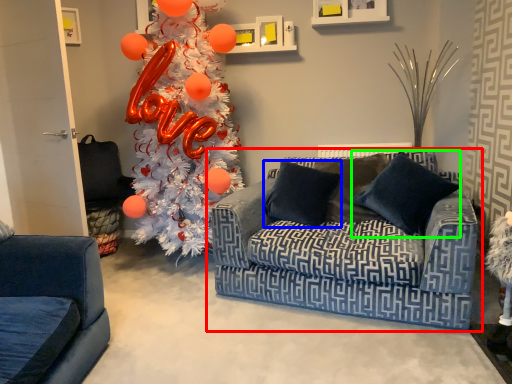
Question: Which object is the farthest from studio couch (highlighted by a red box)? Choose among these: pillow (highlighted by a blue box) or pillow (highlighted by a green box).

Choices:
 (A) pillow
 (B) pillow

Answer: (B)